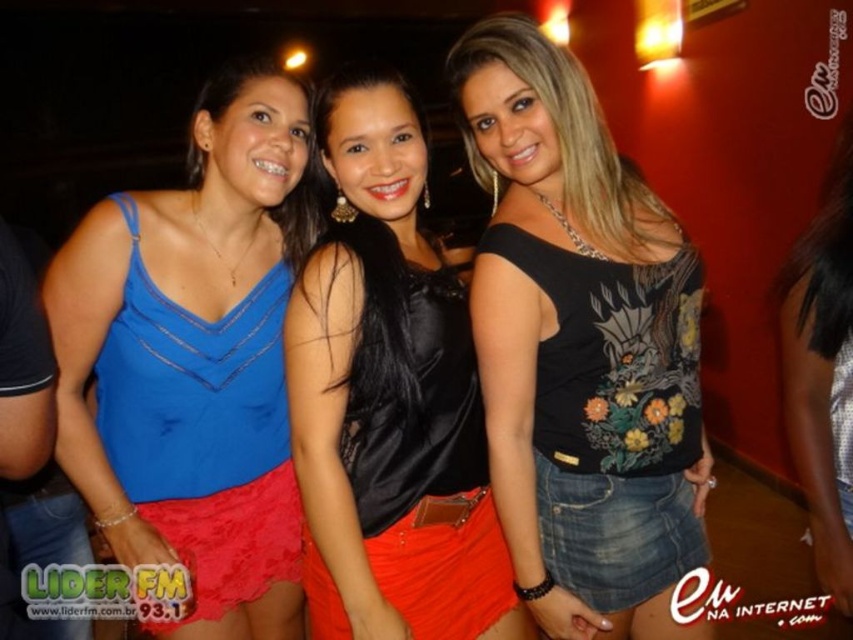
Is black floral top at center positioned behind black satin top at center?

Yes, it is.

Can you confirm if black floral top at center is thinner than black satin top at center?

Incorrect, black floral top at center's width is not less than black satin top at center's.

The image size is (853, 640). Identify the location of black floral top at center. (579, 348).

The width and height of the screenshot is (853, 640). Identify the location of black floral top at center. (579, 348).

Measure the distance between point [375,323] and camera.

They are 1.32 meters apart.

The image size is (853, 640). Identify the location of black satin top at center. (389, 400).

From the picture: Who is more distant from viewer, [471,449] or [799,323]?

The point [799,323] is behind.

I want to click on black satin top at center, so click(389, 400).

Who is taller, black floral top at center or blue satin tank top at left?

With more height is blue satin tank top at left.

In the scene shown: Can you confirm if black floral top at center is positioned to the right of blue satin tank top at left?

Yes, black floral top at center is to the right of blue satin tank top at left.

Where is `black floral top at center`? black floral top at center is located at coordinates (579, 348).